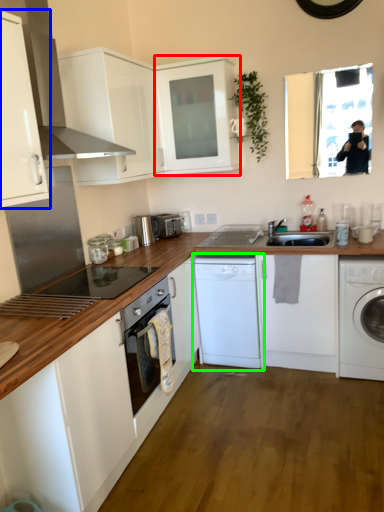
Question: Which is nearer to the cabinetry (highlighted by a red box)? cabinetry (highlighted by a blue box) or washing machine (highlighted by a green box).

Choices:
 (A) cabinetry
 (B) washing machine

Answer: (B)